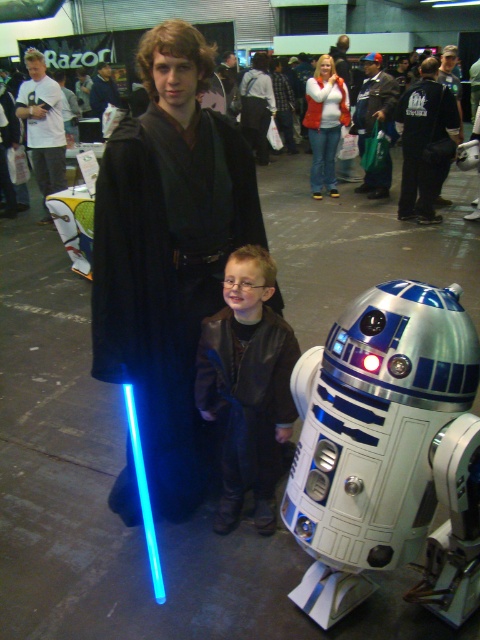
Question: Does leather jacket at center appear on the left side of white t-shirt at upper left?

Choices:
 (A) yes
 (B) no

Answer: (B)

Question: Which object appears closest to the camera in this image?

Choices:
 (A) black fabric jacket at upper center
 (B) dark blue jeans at center

Answer: (A)

Question: Estimate the real-world distances between objects in this image. Which object is farther from the leather jacket at center?

Choices:
 (A) black fabric jacket at upper center
 (B) smooth black robe at center

Answer: (B)

Question: In this image, where is white t-shirt at upper left located relative to dark blue jeans at center?

Choices:
 (A) left
 (B) right

Answer: (A)

Question: Where is white t-shirt at upper left located in relation to smooth black robe at center in the image?

Choices:
 (A) right
 (B) left

Answer: (A)

Question: Which point is farther to the camera?

Choices:
 (A) smooth black robe at center
 (B) black fabric jacket at upper center
 (C) black matte robe at center

Answer: (A)